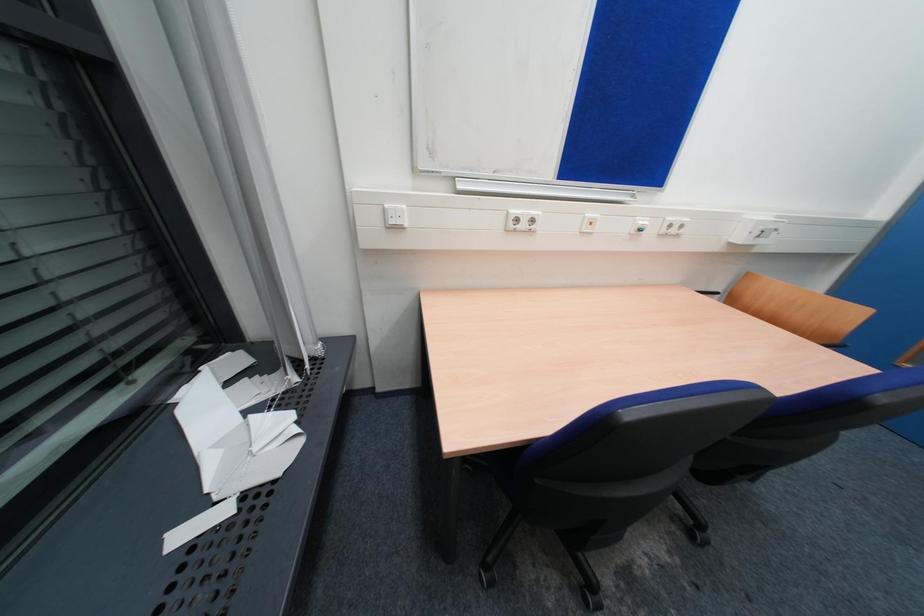
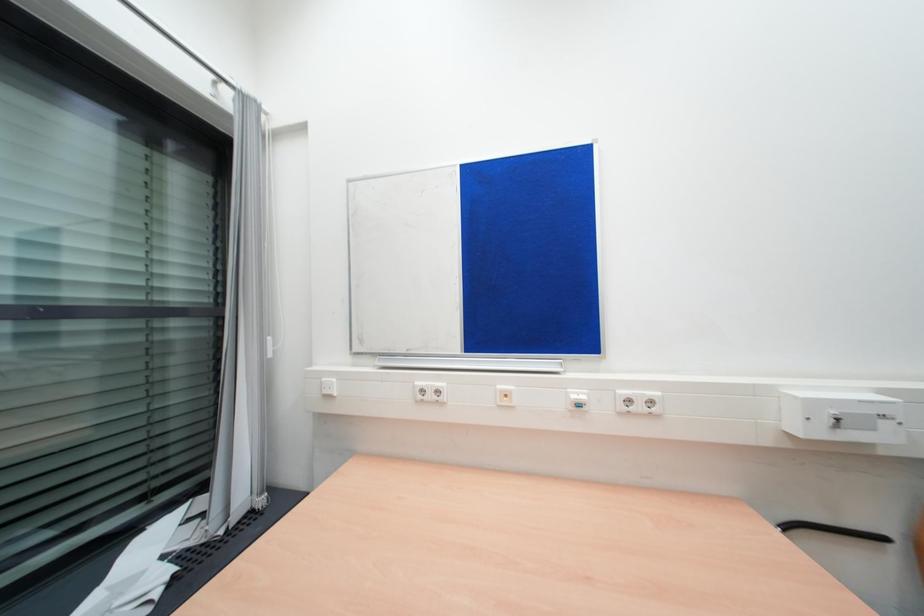
How did the camera likely rotate?

The rotation direction of the camera is left-up.